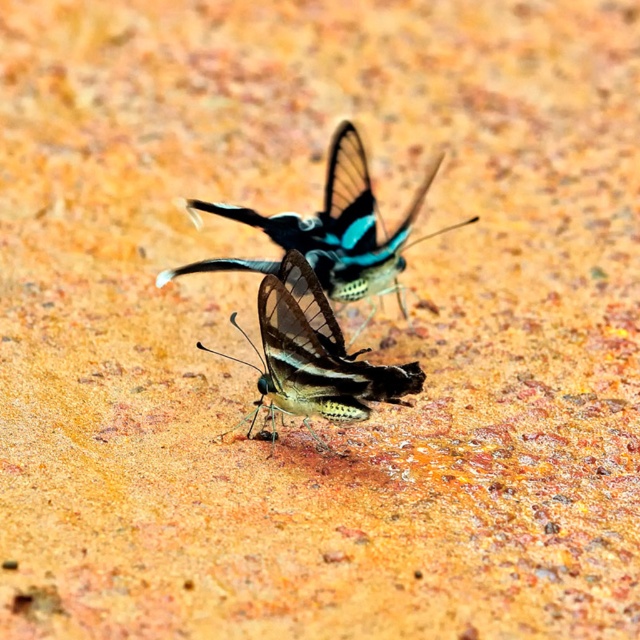
Locate an element on the screen. shiny metallic butterfly at center is located at coordinates (314, 355).

Can you confirm if shiny metallic butterfly at center is positioned below shiny blue butterfly at center?

Yes, shiny metallic butterfly at center is below shiny blue butterfly at center.

Find the location of `shiny metallic butterfly at center`. shiny metallic butterfly at center is located at coordinates (314, 355).